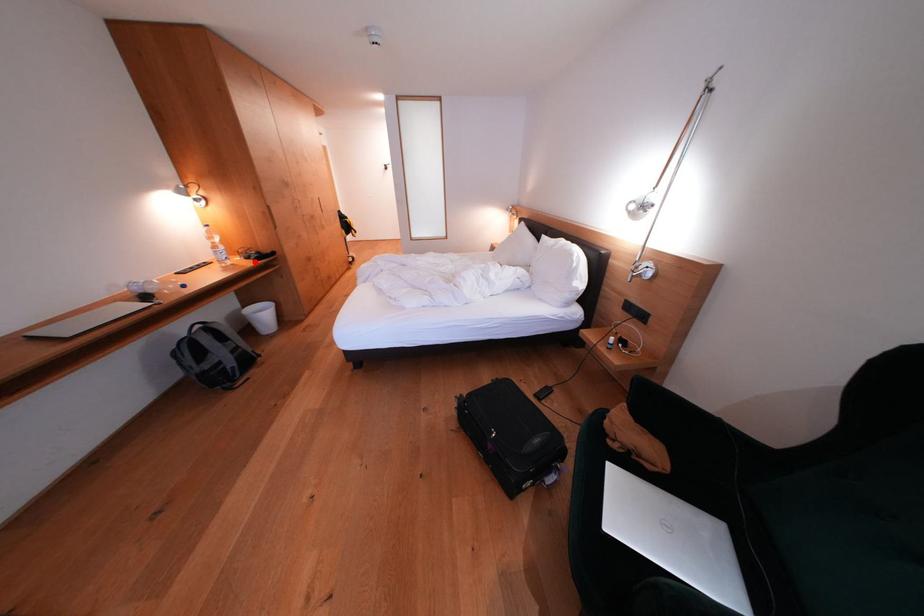
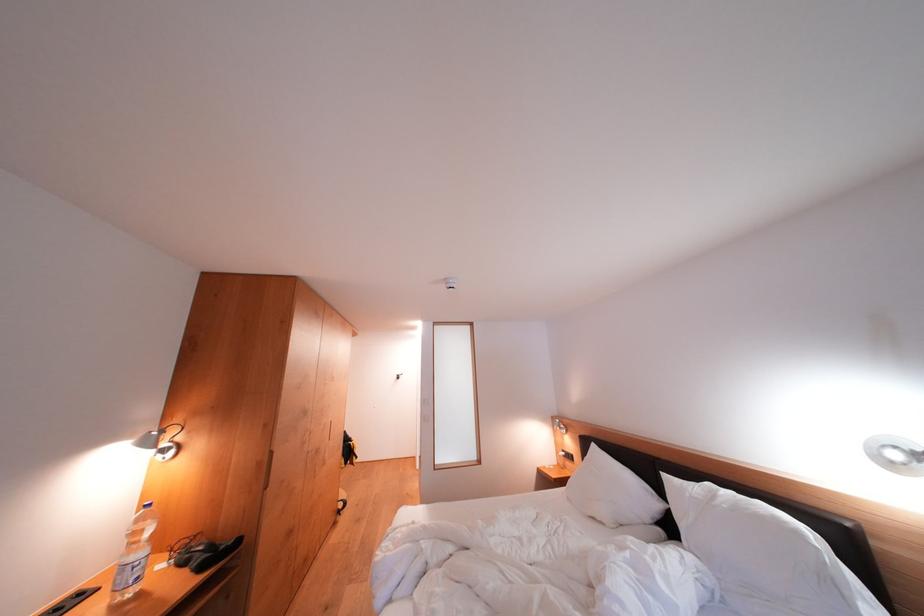
Question: A red point is marked in image1. In image2, is the corresponding 3D point closer to the camera or farther? Reply with the corresponding letter.

Choices:
 (A) The corresponding 3D point is closer.
 (B) The corresponding 3D point is farther.

Answer: (B)